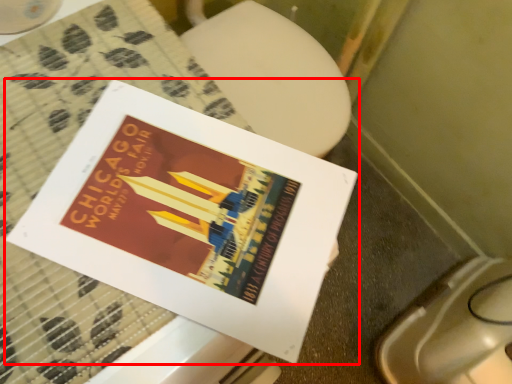
Question: From the image's perspective, what is the correct spatial positioning of book (annotated by the red box) in reference to toilet bowl?

Choices:
 (A) above
 (B) below

Answer: (A)